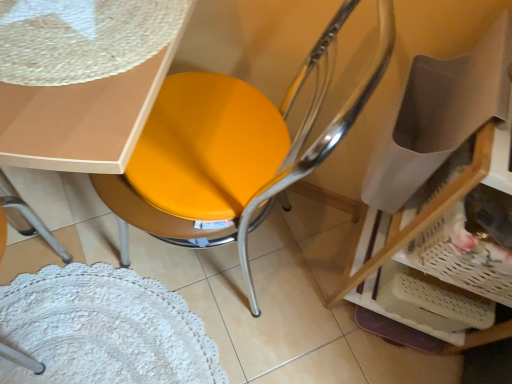
You are a GUI agent. You are given a task and a screenshot of the screen. Output one action in this format:
    pyautogui.click(x=<x>, y=<y>)
    Task: Click on the free spot to the right of matte yellow seat at center
    The width and height of the screenshot is (512, 384).
    Given the screenshot: What is the action you would take?
    pyautogui.click(x=317, y=288)